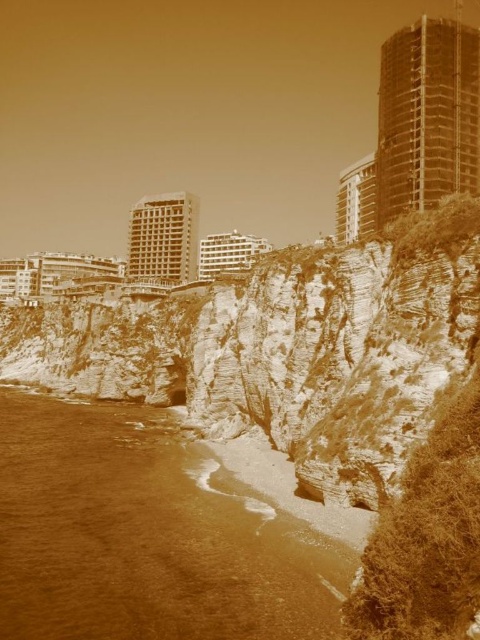
You are a drone operator tasked with capturing aerial footage of the smooth concrete building at upper center. The drone must fly from the beach in the foreground to the building. Given that the drone can only ascend at a 45 degree angle, will it be able to reach the building without colliding with the cliffs in the middle ground?

The smooth concrete building at upper center is located at coordinates point (356, 200). Since the drone ascends at a 45 degree angle from the beach, it would follow a straight path directly towards the building. The cliffs in the middle ground rise steeply from the beach but their position does not block this diagonal trajectory. Therefore the drone can safely reach the building without collision.

What are the coordinates of the brown sand at lower left in the image?

The coordinates of the brown sand at lower left are at point (146,536).

You are standing on the beach in the image and want to reach the smooth concrete building at upper center. The path you need to take is 438.51 feet long. If you walk at a speed of 3 feet per second, how many seconds will it take you to reach the building?

The path to the smooth concrete building at upper center is 438.51 feet long. Walking at 3 feet per second, it would take 438.51 divided by 3, which equals approximately 146.17 seconds.